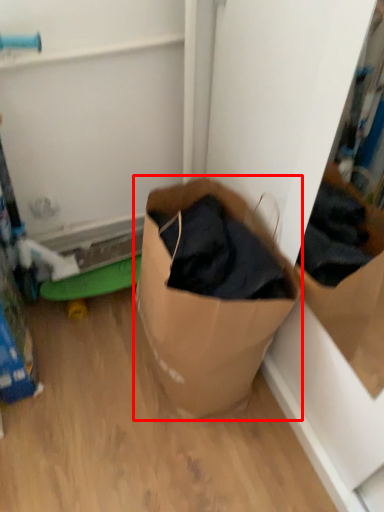
Question: From the image's perspective, considering the relative positions of box (annotated by the red box) and toy in the image provided, where is box (annotated by the red box) located with respect to the staircase?

Choices:
 (A) above
 (B) below

Answer: (A)